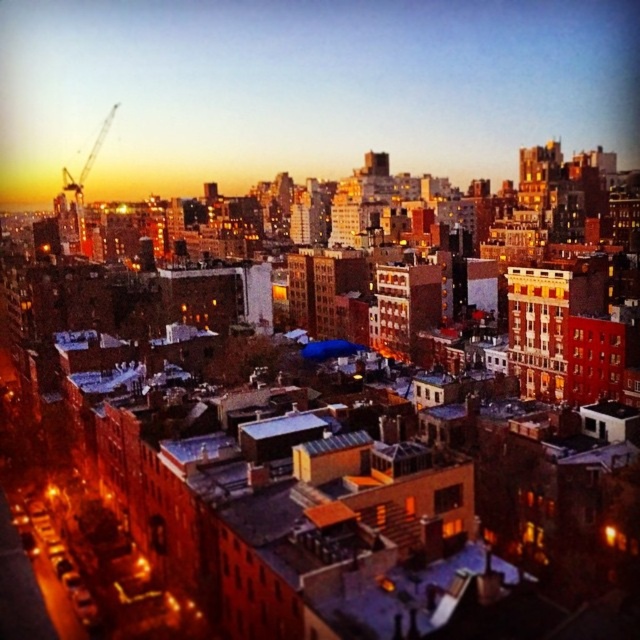
You are a city planner evaluating the urban layout. Considering the matte concrete buildings at center and the metallic construction crane at upper left, which structure occupies more horizontal space in the scene?

The matte concrete buildings at center might be wider than metallic construction crane at upper left, so they likely occupy more horizontal space in the scene.

You are a drone operator tasked with delivering a package from the metallic construction crane at upper left to the matte concrete buildings at center. The drone has a maximum flight range of 150 meters. Can the drone safely complete the delivery without needing a recharge?

The distance between the metallic construction crane at upper left and the matte concrete buildings at center is 128.49 meters, which is within the drone operator stated maximum flight range of 150 meters. The drone can safely complete the delivery without needing a recharge.

You are an architect examining the cityscape. You notice the metallic construction crane at upper left and the matte concrete buildings at center. Which object is positioned farther away from your viewpoint?

The metallic construction crane at upper left is farther away from your viewpoint because it is positioned behind the matte concrete buildings at center.